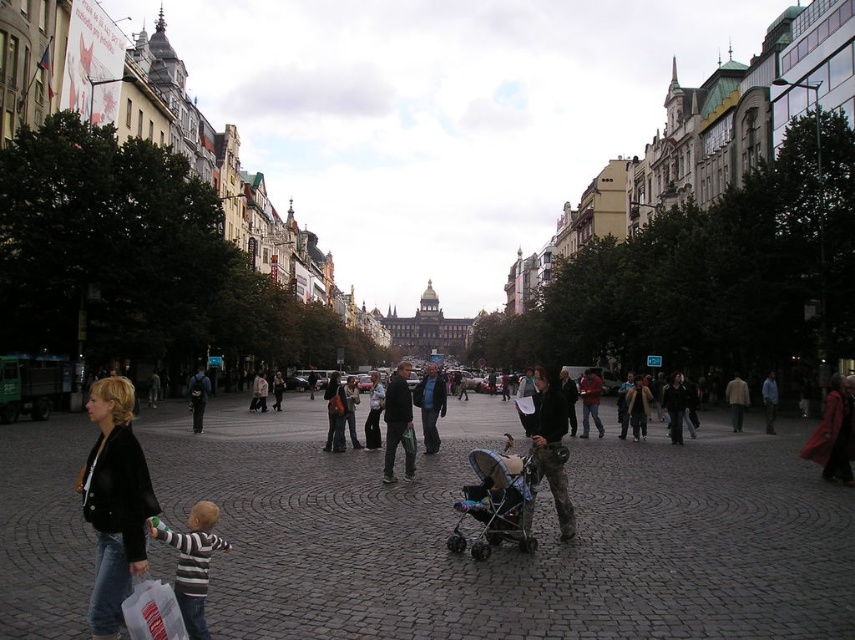
Looking at this image, can you confirm if matte black stroller at center is positioned to the left of striped cotton shirt at lower left?

In fact, matte black stroller at center is to the right of striped cotton shirt at lower left.

Does matte black stroller at center have a greater height compared to striped cotton shirt at lower left?

No.

Describe the element at coordinates (494, 500) in the screenshot. I see `matte black stroller at center` at that location.

The height and width of the screenshot is (640, 855). What are the coordinates of `matte black stroller at center` in the screenshot? It's located at (494, 500).

Who is positioned more to the left, black leather jacket at lower left or striped cotton shirt at lower left?

Positioned to the left is black leather jacket at lower left.

Can you confirm if black leather jacket at lower left is bigger than striped cotton shirt at lower left?

Indeed, black leather jacket at lower left has a larger size compared to striped cotton shirt at lower left.

Where is `black leather jacket at lower left`? The width and height of the screenshot is (855, 640). black leather jacket at lower left is located at coordinates (115, 502).

Who is higher up, black leather jacket at lower left or matte black stroller at center?

black leather jacket at lower left is above.

Image resolution: width=855 pixels, height=640 pixels. Describe the element at coordinates (115, 502) in the screenshot. I see `black leather jacket at lower left` at that location.

At what (x,y) coordinates should I click in order to perform the action: click on black leather jacket at lower left. Please return your answer as a coordinate pair (x, y). This screenshot has height=640, width=855. Looking at the image, I should click on (115, 502).